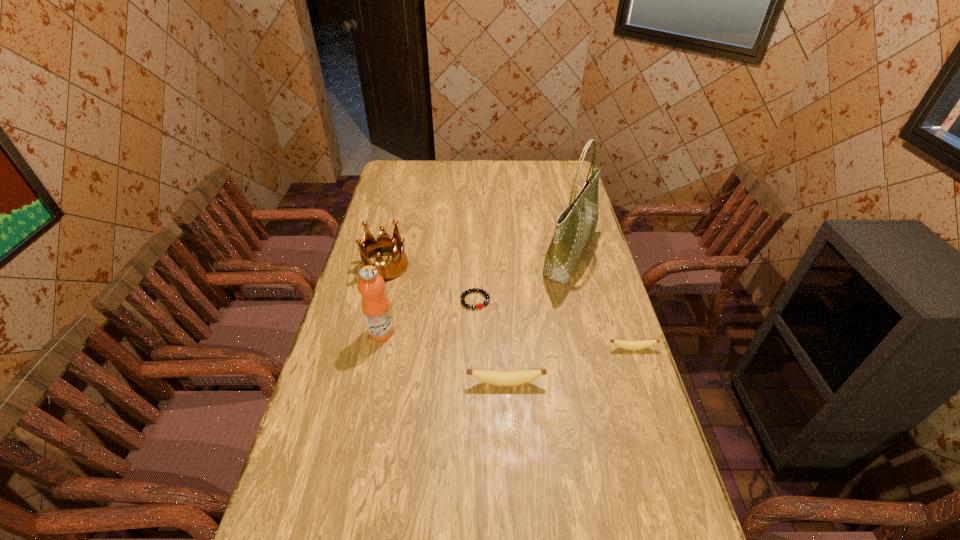
The width and height of the screenshot is (960, 540). Find the location of `free space at the far edge`. free space at the far edge is located at coordinates (486, 176).

Locate an element on the screen. This screenshot has height=540, width=960. vacant space at the near edge is located at coordinates (348, 533).

The height and width of the screenshot is (540, 960). In order to click on vacant space at the left edge in this screenshot , I will do `click(331, 344)`.

Find the location of a particular element. This screenshot has height=540, width=960. vacant space at the right edge is located at coordinates (600, 384).

Image resolution: width=960 pixels, height=540 pixels. In the image, there is a desktop. Find the location of `free space at the far left corner`. free space at the far left corner is located at coordinates (387, 176).

In the image, there is a desktop. Where is `free space at the near left corner`? The width and height of the screenshot is (960, 540). free space at the near left corner is located at coordinates (340, 510).

Locate an element on the screen. This screenshot has height=540, width=960. free area in between the fourth farthest object and the nearest object is located at coordinates (444, 357).

The width and height of the screenshot is (960, 540). Identify the location of vacant area between the fifth farthest object and the shopping bag. (601, 302).

Identify the location of unoccupied position between the shorter banana and the bracelet. (554, 325).

Find the location of `vacant space in between the tallest object and the fourth farthest object`. vacant space in between the tallest object and the fourth farthest object is located at coordinates (475, 294).